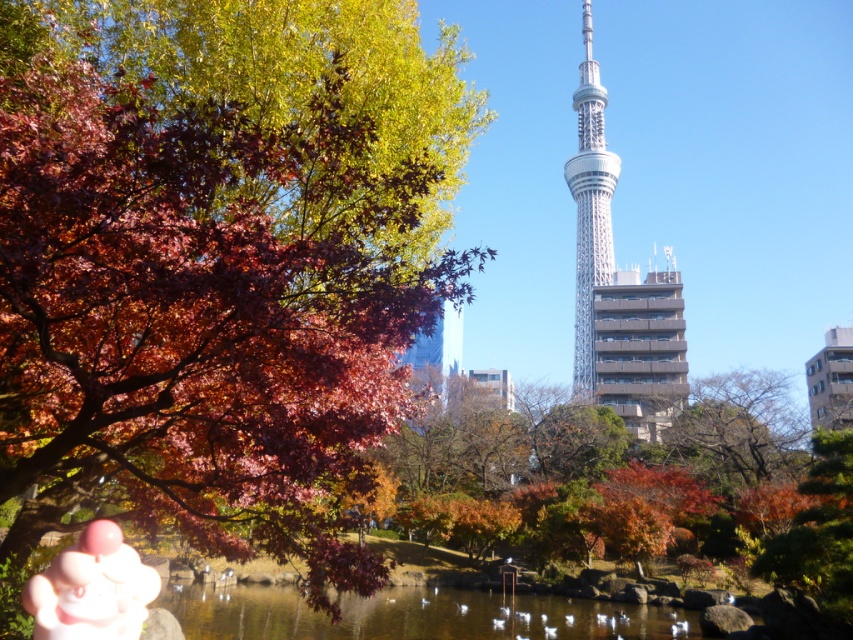
Question: Does matte red maple tree at left have a greater width compared to silver metallic tower at center?

Choices:
 (A) no
 (B) yes

Answer: (B)

Question: Which is nearer to the pink rubber hand at lower left?

Choices:
 (A) matte red maple tree at left
 (B) transparent water at center
 (C) silver metallic tower at center

Answer: (A)

Question: Considering the relative positions of transparent water at center and pink rubber hand at lower left in the image provided, where is transparent water at center located with respect to pink rubber hand at lower left?

Choices:
 (A) left
 (B) right

Answer: (B)

Question: Which object appears closest to the camera in this image?

Choices:
 (A) silver metallic tower at center
 (B) pink rubber hand at lower left
 (C) matte red maple tree at left

Answer: (C)

Question: Which is farther from the silver metallic tower at center?

Choices:
 (A) transparent water at center
 (B) pink rubber hand at lower left

Answer: (B)

Question: Is pink rubber hand at lower left bigger than silver metallic tower at center?

Choices:
 (A) no
 (B) yes

Answer: (A)